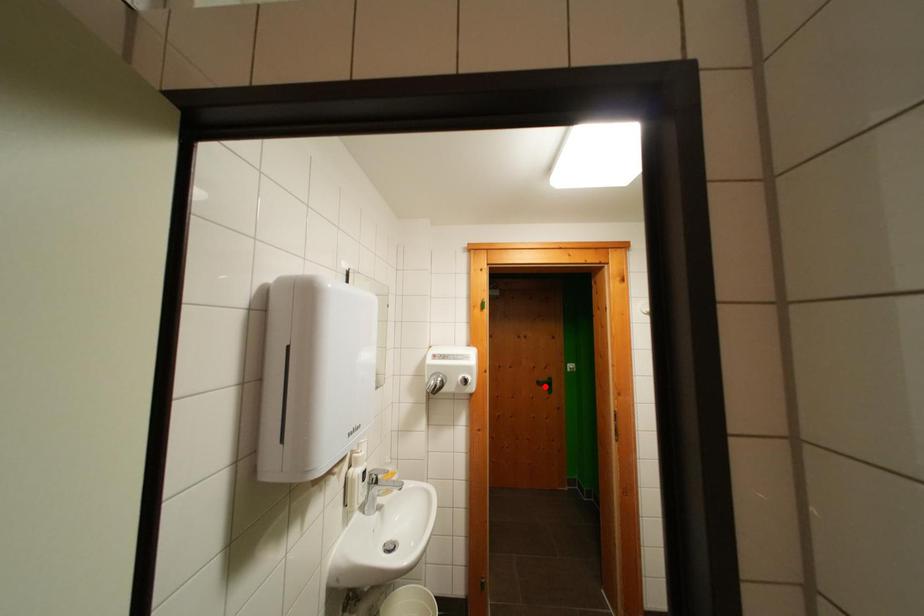
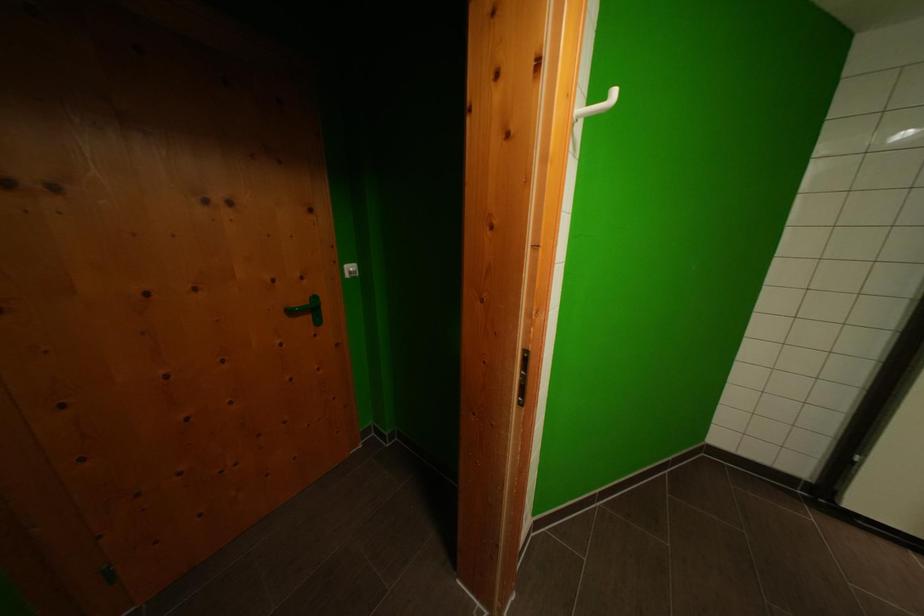
Question: I am providing you with two images of the same scene from different viewpoints. In image1, a red point is highlighted. Considering the same 3D point in image2, which of the following is correct?

Choices:
 (A) It is closer
 (B) It is farther

Answer: (A)